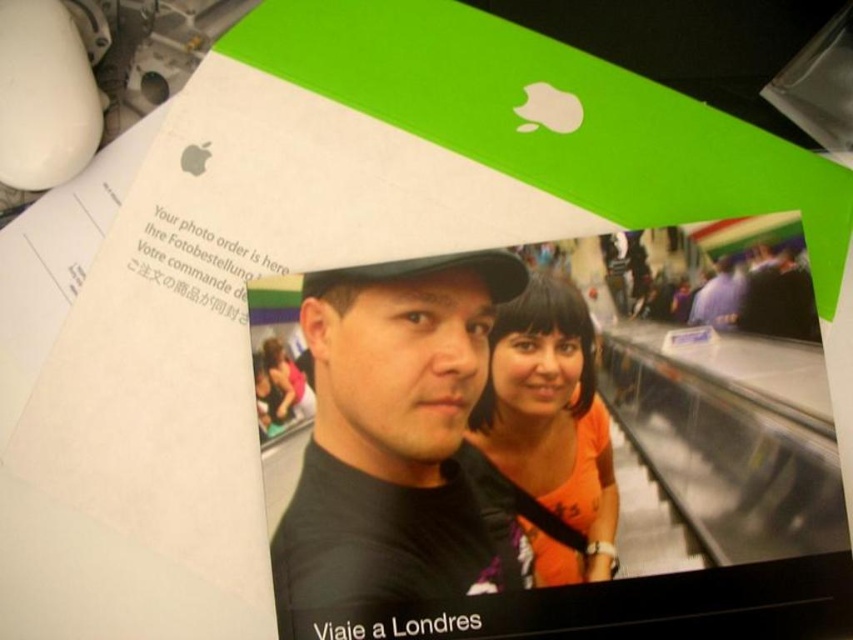
You are designing a layout for a photo collage and want to place the black matte shirt at center and orange matte shirt at center side by side. Which shirt should you place on the left to ensure they fit within the available space?

The black matte shirt at center has a larger width than the orange matte shirt at center, so placing the wider black matte shirt at center on the left would allow both to fit side by side without overlapping.

You are designing a digital photo frame that can display a maximum of 2 inches between the edges of two central shirts. Given the black matte shirt at center and orange matte shirt at center in the photo, will they fit within the frame?

The black matte shirt at center and orange matte shirt at center are 1.92 inches apart, which is within the 2 inches limit, so they will fit within the frame.

You are a photographer reviewing a photo order. You notice two people in the photo, one wearing a black matte shirt at center and the other an orange matte shirt at center. Which shirt appears closer to you in the image?

The black matte shirt at center appears closer to you because it is positioned further to the viewer than the orange matte shirt at center.